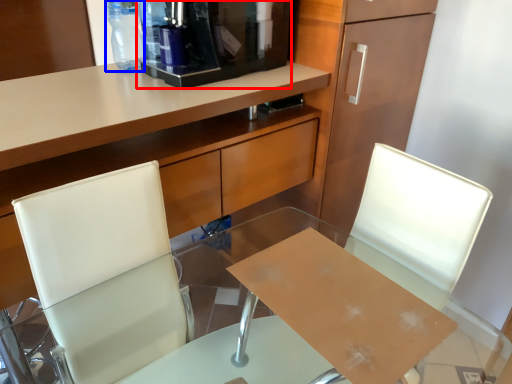
Question: Which object appears farthest to the camera in this image, coffee machine (highlighted by a red box) or bottle (highlighted by a blue box)?

Choices:
 (A) coffee machine
 (B) bottle

Answer: (B)